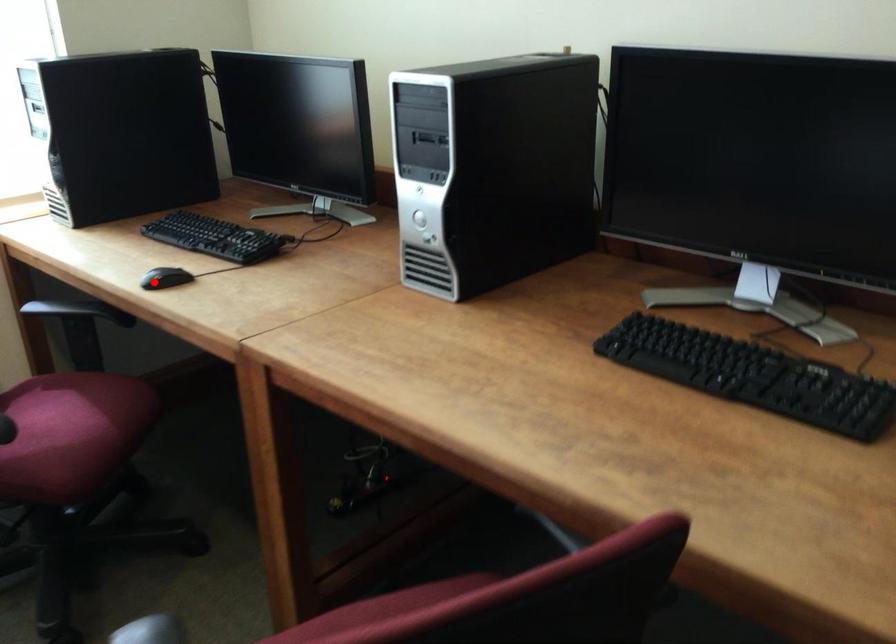
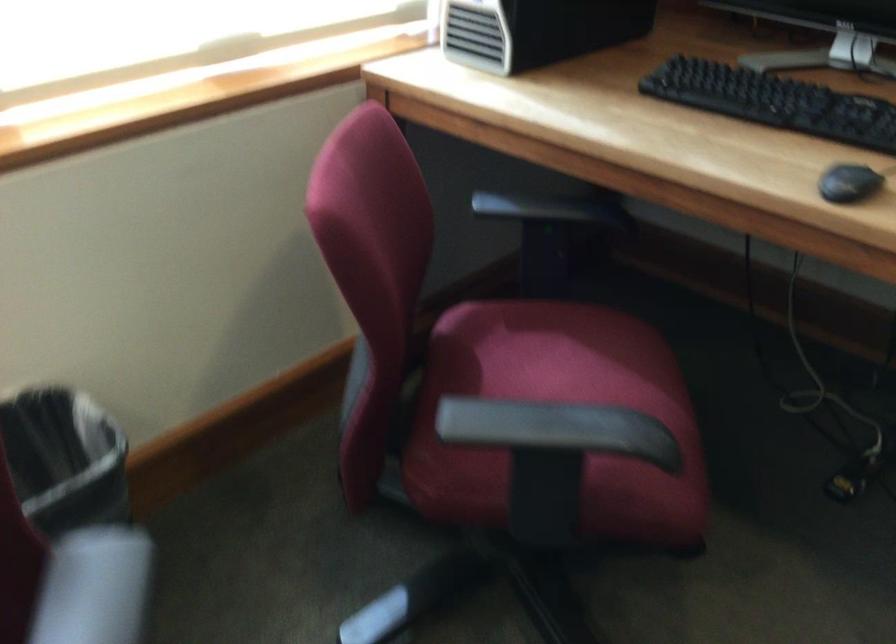
The point at the highlighted location is marked in the first image. Where is the corresponding point in the second image?

(848, 183)